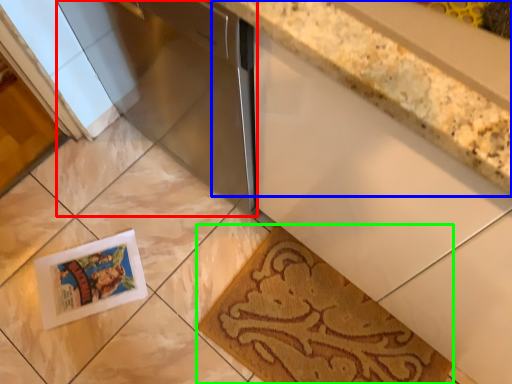
Question: Considering the real-world distances, which object is closest to appliance (highlighted by a red box)? countertop (highlighted by a blue box) or mat (highlighted by a green box).

Choices:
 (A) countertop
 (B) mat

Answer: (A)